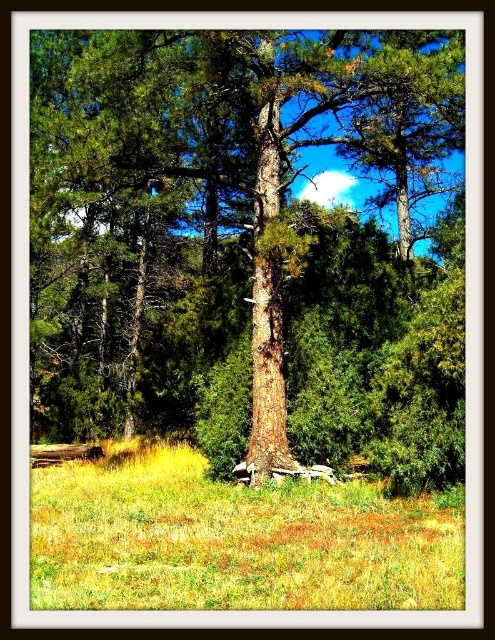
Looking at this image, you are standing in the forest scene and want to walk from the point at coordinates point (x=300, y=64) to the point at coordinates point (x=217, y=598). Which direction should you move to get closer to your destination?

Since point (x=300, y=64) is further to the viewer than point (x=217, y=598), you should move forward towards the background of the image to reach point (x=217, y=598).

You are a hiker who wants to take a photo of the brown rough bark tree at center and the yellow grass at center. To ensure both are in focus, which one should you position closer to the camera?

The brown rough bark tree at center is larger in size compared to the yellow grass at center, so you should position the brown rough bark tree at center closer to the camera to ensure both are in focus.